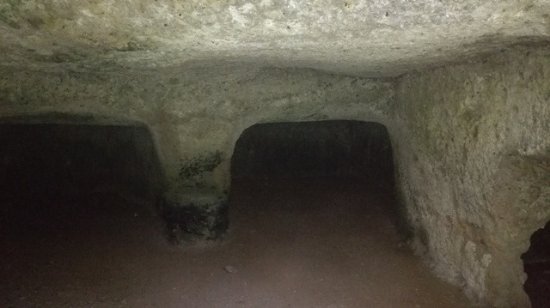
At what (x,y) coordinates should I click in order to perform the action: click on curved corner. Please return your answer as a coordinate pair (x, y). This screenshot has width=550, height=308. Looking at the image, I should click on (245, 130).